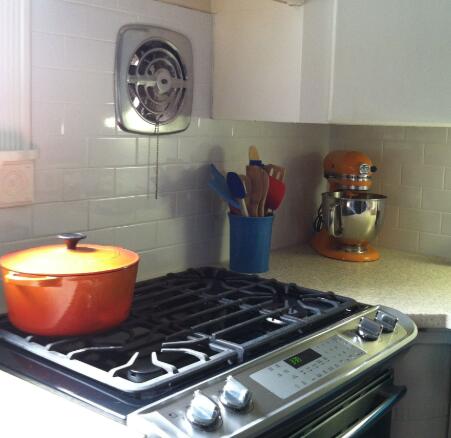
What are the coordinates of `control panel buttons` in the screenshot? It's located at (324, 368).